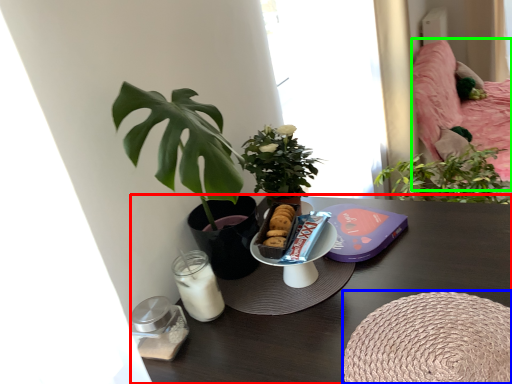
Question: Which object is the farthest from table (highlighted by a red box)? Choose among these: round table (highlighted by a blue box) or bed (highlighted by a green box).

Choices:
 (A) round table
 (B) bed

Answer: (B)